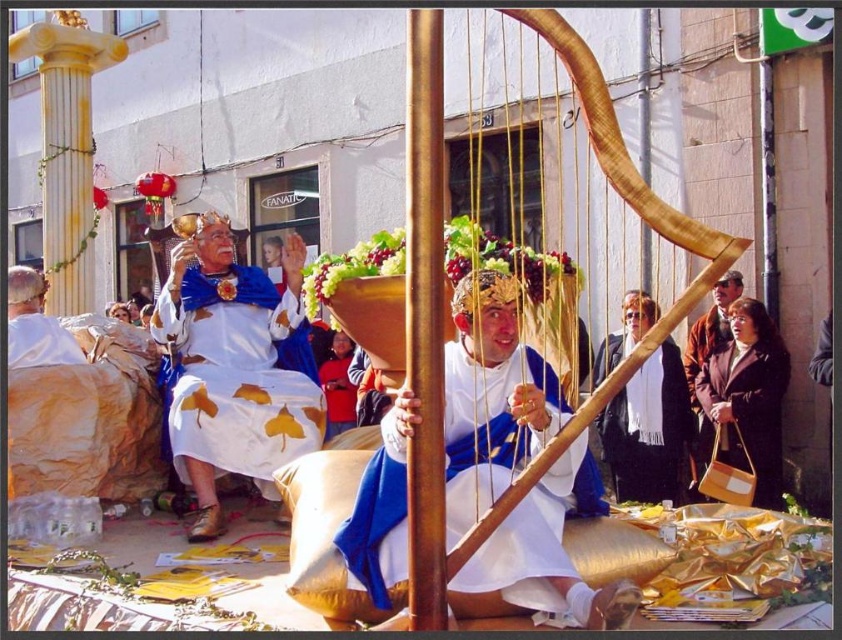
Question: Which point is farther from the camera taking this photo?

Choices:
 (A) (457, 584)
 (B) (707, 381)
 (C) (345, 364)

Answer: (C)

Question: Which object appears closest to the camera in this image?

Choices:
 (A) matte gold crown at center
 (B) brown leather handbag at lower right
 (C) white satin dress at upper left
 (D) white satin robe at center

Answer: (D)

Question: Where is white scarf at center located in relation to matte gold crown at center in the image?

Choices:
 (A) below
 (B) above

Answer: (B)

Question: Which object is the farthest from the white satin robe at center?

Choices:
 (A) white scarf at center
 (B) brown leather handbag at lower right
 (C) white fabric at left

Answer: (A)

Question: Is white satin robe at center closer to camera compared to matte gold crown at center?

Choices:
 (A) yes
 (B) no

Answer: (A)

Question: Can you confirm if white satin dress at upper left is smaller than brown leather handbag at lower right?

Choices:
 (A) no
 (B) yes

Answer: (A)